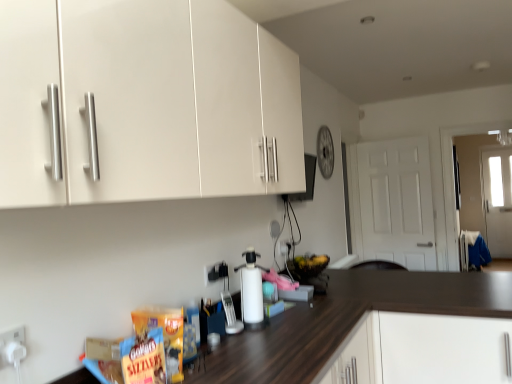
This screenshot has width=512, height=384. What do you see at coordinates (12, 346) in the screenshot?
I see `white plastic electric outlet at lower left, positioned as the third electric outlet in back-to-front order` at bounding box center [12, 346].

The height and width of the screenshot is (384, 512). What do you see at coordinates (284, 247) in the screenshot?
I see `white plastic electric outlet at center, which appears as the third electric outlet when viewed from the left` at bounding box center [284, 247].

At what (x,y) coordinates should I click in order to perform the action: click on white matte bottle at center. Please return your answer as a coordinate pair (x, y). The width and height of the screenshot is (512, 384). Looking at the image, I should click on (251, 291).

Where is `white matte cabinet at lower right`? Image resolution: width=512 pixels, height=384 pixels. white matte cabinet at lower right is located at coordinates (422, 350).

From a real-world perspective, is white matte bottle at center positioned above or below white matte door at right?

white matte bottle at center is below white matte door at right.

How different are the orientations of white matte bottle at center and white matte door at right in degrees?

98 degrees separate the facing orientations of white matte bottle at center and white matte door at right.

Which of these two, white matte bottle at center or white matte door at right, stands shorter?

white matte bottle at center.

Considering the relative positions of white matte bottle at center and white matte door at right in the image provided, is white matte bottle at center to the left or to the right of white matte door at right?

white matte bottle at center is to the left of white matte door at right.

Considering the sizes of white plastic electric outlet at center, which appears as the 2th electric outlet when viewed from the right, and white plastic electric outlet at center, arranged as the 1th electric outlet when viewed from the back, in the image, is white plastic electric outlet at center, which appears as the 2th electric outlet when viewed from the right, wider or thinner than white plastic electric outlet at center, arranged as the 1th electric outlet when viewed from the back,?

white plastic electric outlet at center, which appears as the 2th electric outlet when viewed from the right, is wider than white plastic electric outlet at center, arranged as the 1th electric outlet when viewed from the back.

Is white plastic electric outlet at center, which appears as the 2th electric outlet when viewed from the right, positioned in front of white plastic electric outlet at center, the third electric outlet when ordered from front to back?

Yes, white plastic electric outlet at center, which appears as the 2th electric outlet when viewed from the right, is closer to the camera.

Can you tell me how much white plastic electric outlet at center, the 2th electric outlet positioned from the left, and white plastic electric outlet at center, which appears as the first electric outlet when viewed from the right, differ in facing direction?

There is a 0.00805-degree angle between the facing directions of white plastic electric outlet at center, the 2th electric outlet positioned from the left, and white plastic electric outlet at center, which appears as the first electric outlet when viewed from the right.

Where is `the 1st electric outlet located beneath the white plastic electric outlet at center, the third electric outlet when ordered from front to back (from a real-world perspective)`? the 1st electric outlet located beneath the white plastic electric outlet at center, the third electric outlet when ordered from front to back (from a real-world perspective) is located at coordinates (216, 272).

At what (x,y) coordinates should I click in order to perform the action: click on door located above the white plastic electric outlet at lower left, positioned as the first electric outlet in front-to-back order (from a real-world perspective). Please return your answer as a coordinate pair (x, y). The width and height of the screenshot is (512, 384). Looking at the image, I should click on (396, 202).

From a real-world perspective, relative to white plastic electric outlet at lower left, positioned as the first electric outlet in left-to-right order, is white matte door at right vertically above or below?

white matte door at right is situated higher than white plastic electric outlet at lower left, positioned as the first electric outlet in left-to-right order, in the real world.

Between white matte door at right and white plastic electric outlet at lower left, positioned as the first electric outlet in left-to-right order, which one appears on the right side from the viewer's perspective?

white matte door at right.

Is white matte door at right far from white plastic electric outlet at lower left, positioned as the first electric outlet in front-to-back order?

Yes, white matte door at right and white plastic electric outlet at lower left, positioned as the first electric outlet in front-to-back order, are located far from each other.

Is white plastic electric outlet at lower left, placed as the 3th electric outlet when sorted from right to left, not inside white matte bottle at center?

Absolutely, white plastic electric outlet at lower left, placed as the 3th electric outlet when sorted from right to left, is external to white matte bottle at center.

I want to click on bottle that appears on the right of white plastic electric outlet at lower left, positioned as the first electric outlet in front-to-back order, so click(251, 291).

Considering the relative sizes of white plastic electric outlet at lower left, positioned as the first electric outlet in left-to-right order, and white matte bottle at center in the image provided, is white plastic electric outlet at lower left, positioned as the first electric outlet in left-to-right order, thinner than white matte bottle at center?

Indeed, white plastic electric outlet at lower left, positioned as the first electric outlet in left-to-right order, has a lesser width compared to white matte bottle at center.

From the image's perspective, which one is positioned higher, white plastic electric outlet at lower left, positioned as the first electric outlet in front-to-back order, or white matte bottle at center?

From the image's view, white plastic electric outlet at lower left, positioned as the first electric outlet in front-to-back order, is above.

Considering the sizes of objects white matte door at right and white matte cabinet at lower right in the image provided, who is shorter, white matte door at right or white matte cabinet at lower right?

white matte cabinet at lower right is shorter.

Is white matte door at right positioned far away from white matte cabinet at lower right?

Absolutely, white matte door at right is distant from white matte cabinet at lower right.

From the image's perspective, is white matte door at right located above white matte cabinet at lower right?

Yes, from the image's perspective, white matte door at right is over white matte cabinet at lower right.

From a real-world perspective, between white matte door at right and white matte cabinet at lower right, who is vertically higher?

In real-world perspective, white matte door at right is above.

From the image's perspective, which object appears higher, white plastic electric outlet at center, which appears as the third electric outlet when viewed from the left, or white plastic electric outlet at lower left, positioned as the first electric outlet in front-to-back order?

white plastic electric outlet at center, which appears as the third electric outlet when viewed from the left, is shown above in the image.

Is white plastic electric outlet at center, arranged as the 1th electric outlet when viewed from the back, to the left or to the right of white plastic electric outlet at lower left, positioned as the first electric outlet in left-to-right order, in the image?

From the image, it's evident that white plastic electric outlet at center, arranged as the 1th electric outlet when viewed from the back, is to the right of white plastic electric outlet at lower left, positioned as the first electric outlet in left-to-right order.

Does point (286, 254) come farther from viewer compared to point (22, 344)?

Yes, it is.

Could you measure the distance between white plastic electric outlet at center, which appears as the first electric outlet when viewed from the right, and white plastic electric outlet at lower left, positioned as the first electric outlet in front-to-back order?

white plastic electric outlet at center, which appears as the first electric outlet when viewed from the right, is 5.70 feet from white plastic electric outlet at lower left, positioned as the first electric outlet in front-to-back order.

Consider the image. From the image's perspective, which one is positioned lower, white matte bottle at center or white matte cabinet at lower right?

white matte cabinet at lower right.

Can you confirm if white matte bottle at center is wider than white matte cabinet at lower right?

Incorrect, the width of white matte bottle at center does not surpass that of white matte cabinet at lower right.

Where is `bottle in front of the white matte door at right`? The height and width of the screenshot is (384, 512). bottle in front of the white matte door at right is located at coordinates (251, 291).

At what (x,y) coordinates should I click in order to perform the action: click on electric outlet on the right side of white plastic electric outlet at center, the 2th electric outlet when ordered from front to back. Please return your answer as a coordinate pair (x, y). This screenshot has width=512, height=384. Looking at the image, I should click on (284, 247).

Considering their positions, is white plastic electric outlet at center, the 2th electric outlet positioned from the left, positioned further to white plastic electric outlet at lower left, positioned as the first electric outlet in left-to-right order, than white matte door at right?

white matte door at right.

Looking at the image, which one is located further to white plastic electric outlet at center, the third electric outlet when ordered from front to back, white plastic electric outlet at center, the 2th electric outlet when ordered from back to front, or white matte door at right?

Based on the image, white matte door at right appears to be further to white plastic electric outlet at center, the third electric outlet when ordered from front to back.

Considering their positions, is white matte bottle at center positioned closer to white plastic electric outlet at center, the 2th electric outlet positioned from the left, than white plastic electric outlet at lower left, positioned as the first electric outlet in front-to-back order?

white matte bottle at center is positioned closer to the anchor white plastic electric outlet at center, the 2th electric outlet positioned from the left.

Consider the image. Looking at the image, which one is located closer to white plastic electric outlet at center, arranged as the 1th electric outlet when viewed from the back, white plastic electric outlet at center, the 2th electric outlet when ordered from back to front, or white matte cabinet at lower right?

Among the two, white plastic electric outlet at center, the 2th electric outlet when ordered from back to front, is located nearer to white plastic electric outlet at center, arranged as the 1th electric outlet when viewed from the back.

Estimate the real-world distances between objects in this image. Which object is further from white plastic electric outlet at center, the 2th electric outlet when ordered from front to back, white matte door at right or white matte bottle at center?

Among the two, white matte door at right is located further to white plastic electric outlet at center, the 2th electric outlet when ordered from front to back.

When comparing their distances from white matte cabinet at lower right, does white plastic electric outlet at lower left, placed as the 3th electric outlet when sorted from right to left, or white plastic electric outlet at center, which appears as the third electric outlet when viewed from the left, seem closer?

white plastic electric outlet at center, which appears as the third electric outlet when viewed from the left, is positioned closer to the anchor white matte cabinet at lower right.

When comparing their distances from white matte door at right, does white plastic electric outlet at center, the 2th electric outlet positioned from the left, or white plastic electric outlet at lower left, placed as the 3th electric outlet when sorted from right to left, seem further?

The object further to white matte door at right is white plastic electric outlet at lower left, placed as the 3th electric outlet when sorted from right to left.

Considering their positions, is white matte door at right positioned further to white matte bottle at center than white plastic electric outlet at center, the 2th electric outlet positioned from the left?

The object further to white matte bottle at center is white matte door at right.

Image resolution: width=512 pixels, height=384 pixels. What are the coordinates of `bottle located between white plastic electric outlet at lower left, placed as the 3th electric outlet when sorted from right to left, and white plastic electric outlet at center, the 2th electric outlet positioned from the left, in the depth direction` in the screenshot? It's located at (251, 291).

Locate an element on the screen. This screenshot has width=512, height=384. electric outlet situated between white matte bottle at center and white matte cabinet at lower right from left to right is located at coordinates (284, 247).

Locate an element on the screen. The image size is (512, 384). electric outlet located between white plastic electric outlet at center, the 2th electric outlet when ordered from front to back, and white matte cabinet at lower right in the left-right direction is located at coordinates (284, 247).

Locate an element on the screen. bottle between white matte cabinet at lower right and white matte door at right from front to back is located at coordinates (251, 291).